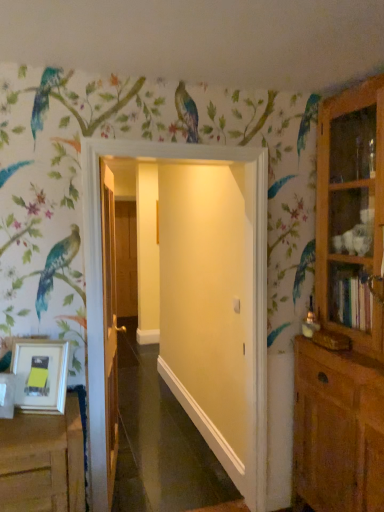
Where is `vacant space behind wooden door at center, marked as the 2th door in a front-to-back arrangement`? vacant space behind wooden door at center, marked as the 2th door in a front-to-back arrangement is located at coordinates (151, 441).